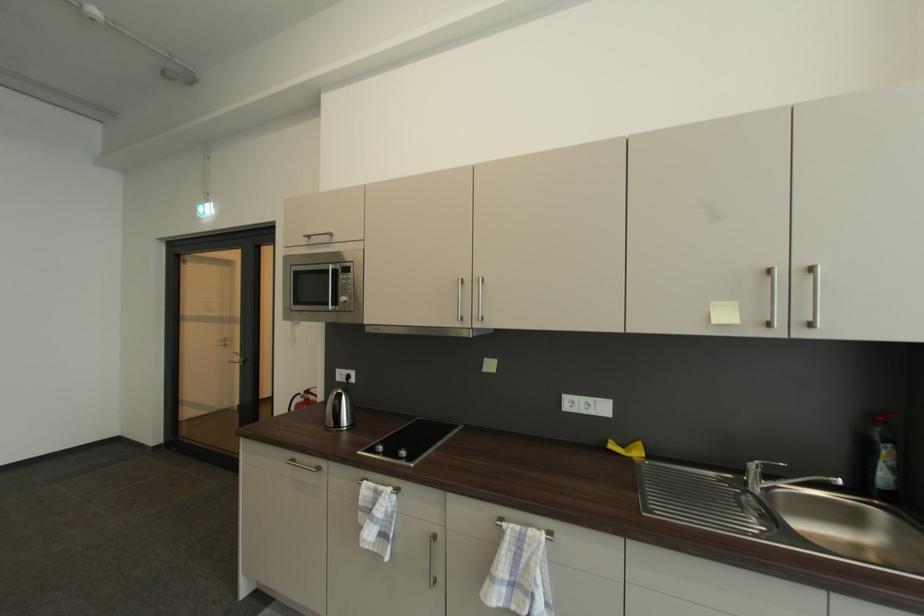
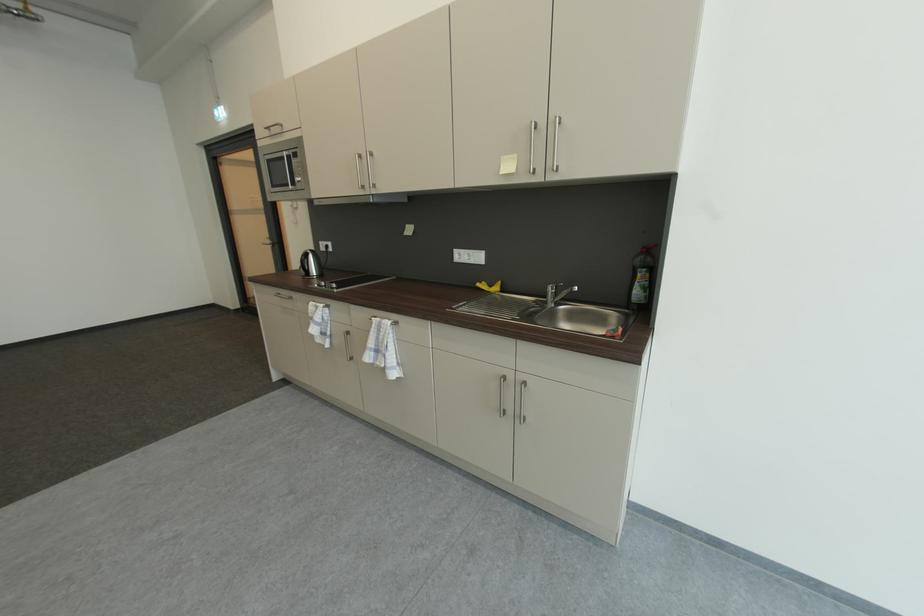
Locate, in the second image, the point that corresponds to point (334, 272) in the first image.

(290, 158)